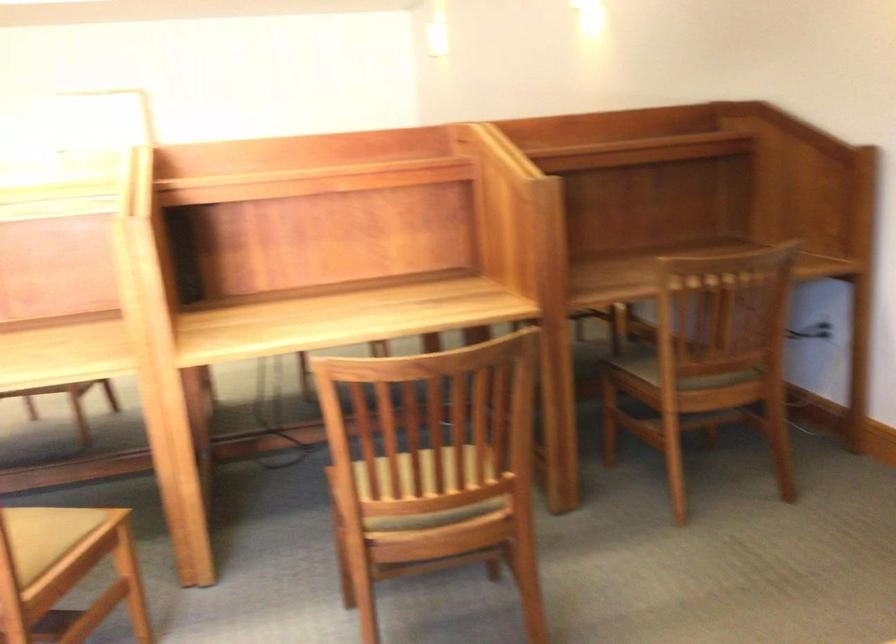
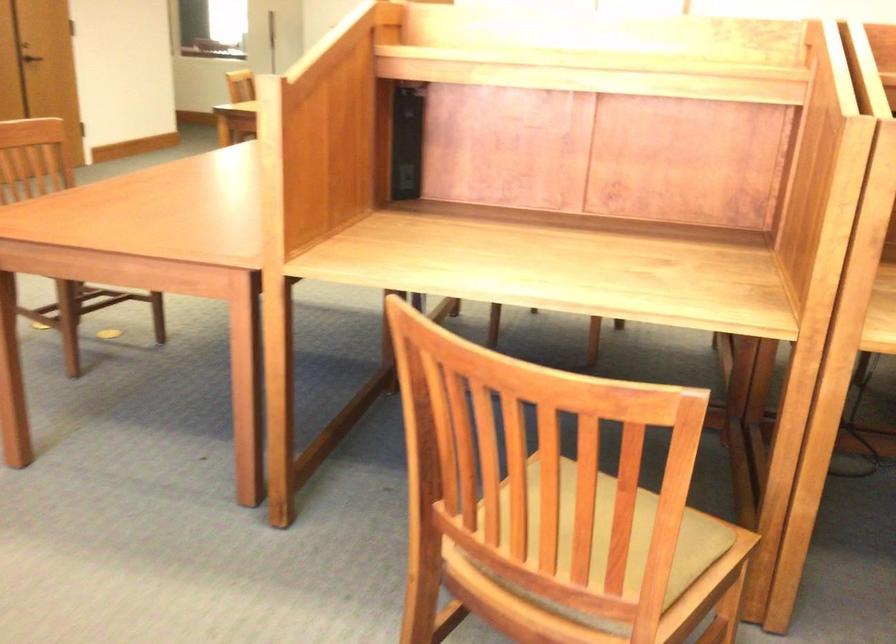
Question: The camera is either moving clockwise (left) or counter-clockwise (right) around the object. The first image is from the beginning of the video and the second image is from the end. Is the camera moving left or right when shooting the video?

Choices:
 (A) Left
 (B) Right

Answer: (B)